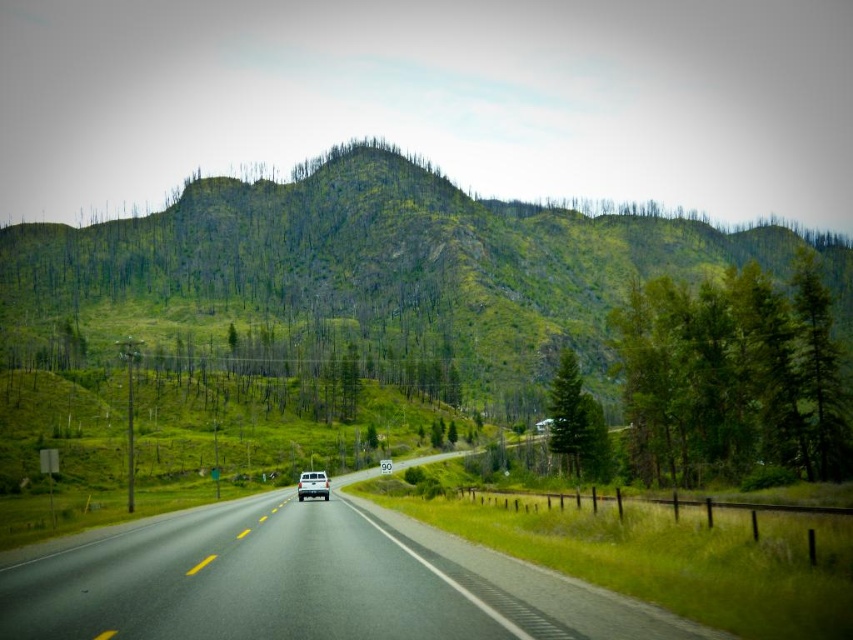
You are driving a car and see the green matte tree at right and the white matte truck at center on the road. Which object is larger in size?

The green matte tree at right is bigger than the white matte truck at center.

You are a drone operator tasked with capturing aerial footage of the mountain road. Your drone has a maximum operational range of 80 meters. You notice a green matte tree at right in the scene. Can your drone safely reach it to capture footage without exceeding its range?

The green matte tree at right is 78.35 meters from camera. Since the drone has a maximum range of 80 meters, it can safely reach the green matte tree at right as the distance is within the operational limit.